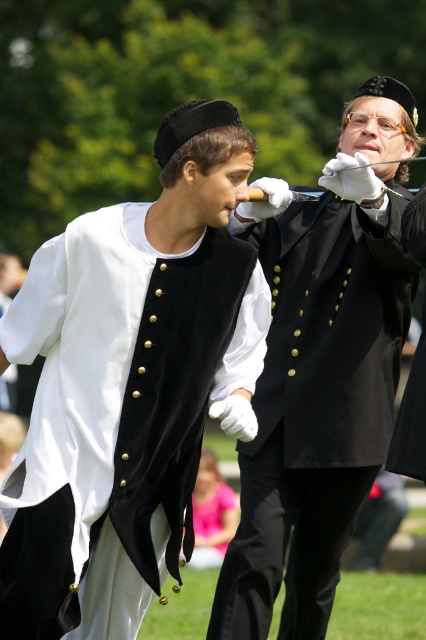
Is velvet black vest at center above black velvet vest at center?

No.

Is velvet black vest at center taller than black velvet vest at center?

Incorrect, velvet black vest at center's height is not larger of black velvet vest at center's.

In order to click on velvet black vest at center in this screenshot , I will do `click(118, 413)`.